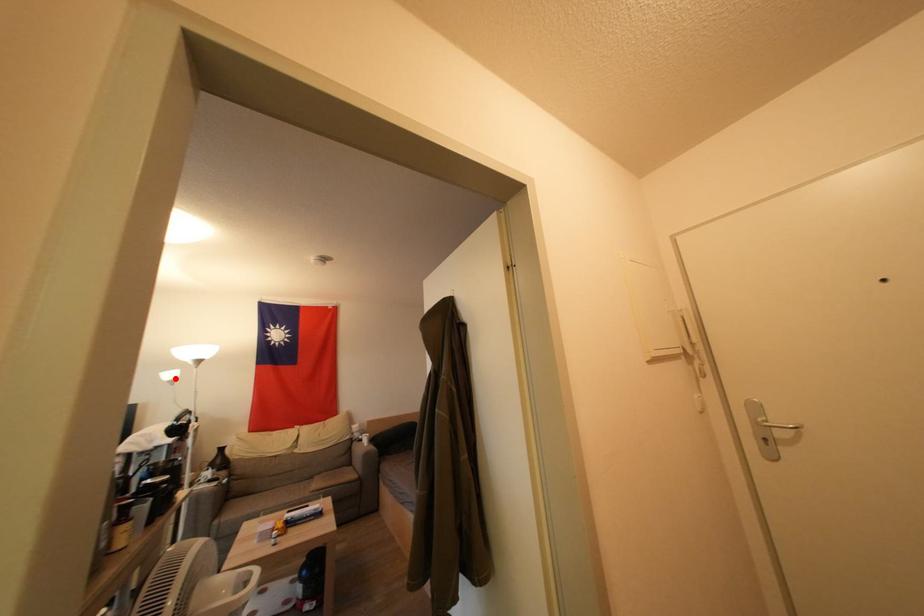
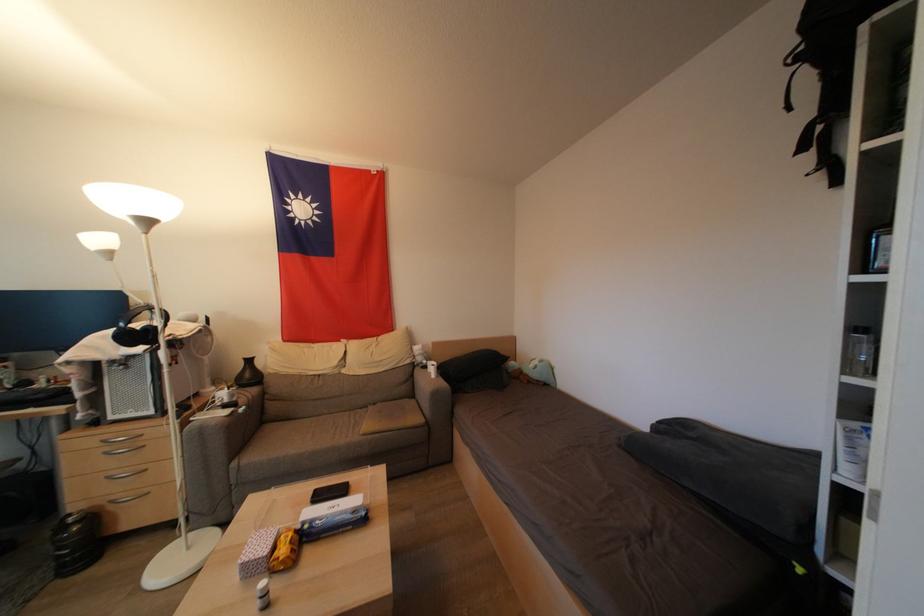
Locate, in the second image, the point that corresponds to the highlighted location in the first image.

(104, 244)